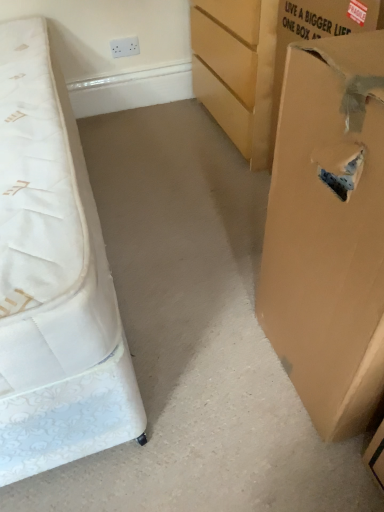
The image size is (384, 512). What do you see at coordinates (53, 278) in the screenshot? I see `white quilted mattress at left` at bounding box center [53, 278].

Describe the element at coordinates (328, 232) in the screenshot. I see `brown cardboard box at right, acting as the 2th cardboard box starting from the top` at that location.

Where is `white quilted mattress at left`? This screenshot has height=512, width=384. white quilted mattress at left is located at coordinates (53, 278).

What's the angular difference between brown cardboard box at right, acting as the 2th cardboard box starting from the top, and brown cardboard box at right, positioned as the 1th cardboard box in top-to-bottom order,'s facing directions?

The angular difference between brown cardboard box at right, acting as the 2th cardboard box starting from the top, and brown cardboard box at right, positioned as the 1th cardboard box in top-to-bottom order, is 1.47 degrees.

Is brown cardboard box at right, the 2th cardboard box in the back-to-front sequence, turned away from brown cardboard box at right, arranged as the second cardboard box when viewed from the front?

No, brown cardboard box at right, the 2th cardboard box in the back-to-front sequence,'s orientation is not away from brown cardboard box at right, arranged as the second cardboard box when viewed from the front.

Looking at this image, does brown cardboard box at right, marked as the first cardboard box in a bottom-to-top arrangement, lie in front of brown cardboard box at right, the 1th cardboard box positioned from the back?

Yes, it is.

Consider the image. Measure the distance between brown cardboard box at right, the 1th cardboard box from the front, and brown cardboard box at right, arranged as the second cardboard box when viewed from the front.

brown cardboard box at right, the 1th cardboard box from the front, and brown cardboard box at right, arranged as the second cardboard box when viewed from the front, are 29.28 inches apart.

Considering the sizes of white quilted mattress at left and brown cardboard box at right, the 2th cardboard box in the back-to-front sequence, in the image, is white quilted mattress at left bigger or smaller than brown cardboard box at right, the 2th cardboard box in the back-to-front sequence,?

white quilted mattress at left is bigger than brown cardboard box at right, the 2th cardboard box in the back-to-front sequence.

Would you say white quilted mattress at left is to the left or to the right of brown cardboard box at right, the 1th cardboard box from the front, in the picture?

white quilted mattress at left is positioned on brown cardboard box at right, the 1th cardboard box from the front,'s left side.

How many degrees apart are the facing directions of white quilted mattress at left and brown cardboard box at right, the 2th cardboard box in the back-to-front sequence?

The angle between the facing direction of white quilted mattress at left and the facing direction of brown cardboard box at right, the 2th cardboard box in the back-to-front sequence, is 89.6 degrees.

Measure the distance between white quilted mattress at left and brown cardboard box at right, marked as the first cardboard box in a bottom-to-top arrangement.

A distance of 19.97 inches exists between white quilted mattress at left and brown cardboard box at right, marked as the first cardboard box in a bottom-to-top arrangement.

Locate an element on the screen. cardboard box behind the white quilted mattress at left is located at coordinates (260, 58).

What's the angular difference between white quilted mattress at left and brown cardboard box at right, positioned as the 1th cardboard box in top-to-bottom order,'s facing directions?

They differ by 91.1 degrees in their facing directions.

Is white quilted mattress at left in front of or behind brown cardboard box at right, arranged as the second cardboard box when viewed from the front, in the image?

white quilted mattress at left is in front of brown cardboard box at right, arranged as the second cardboard box when viewed from the front.

Does brown cardboard box at right, marked as the first cardboard box in a bottom-to-top arrangement, appear on the right side of white quilted mattress at left?

Yes, brown cardboard box at right, marked as the first cardboard box in a bottom-to-top arrangement, is to the right of white quilted mattress at left.

From the image's perspective, is brown cardboard box at right, marked as the first cardboard box in a bottom-to-top arrangement, positioned above or below white quilted mattress at left?

brown cardboard box at right, marked as the first cardboard box in a bottom-to-top arrangement, is situated lower than white quilted mattress at left in the image.

Based on their sizes in the image, would you say brown cardboard box at right, marked as the first cardboard box in a bottom-to-top arrangement, is bigger or smaller than white quilted mattress at left?

Clearly, brown cardboard box at right, marked as the first cardboard box in a bottom-to-top arrangement, is smaller in size than white quilted mattress at left.

Is brown cardboard box at right, the 1th cardboard box from the front, looking in the opposite direction of white quilted mattress at left?

That's not correct — brown cardboard box at right, the 1th cardboard box from the front, is not looking away from white quilted mattress at left.

Considering the positions of objects brown cardboard box at right, which ranks as the second cardboard box in bottom-to-top order, and brown cardboard box at right, the 1th cardboard box from the front, in the image provided, who is behind, brown cardboard box at right, which ranks as the second cardboard box in bottom-to-top order, or brown cardboard box at right, the 1th cardboard box from the front,?

Positioned behind is brown cardboard box at right, which ranks as the second cardboard box in bottom-to-top order.

Is brown cardboard box at right, which ranks as the second cardboard box in bottom-to-top order, bigger than brown cardboard box at right, the 2th cardboard box in the back-to-front sequence?

Correct, brown cardboard box at right, which ranks as the second cardboard box in bottom-to-top order, is larger in size than brown cardboard box at right, the 2th cardboard box in the back-to-front sequence.

How distant is brown cardboard box at right, the 1th cardboard box positioned from the back, from brown cardboard box at right, the 2th cardboard box in the back-to-front sequence?

74.36 centimeters.

From the image's perspective, would you say brown cardboard box at right, arranged as the second cardboard box when viewed from the front, is shown under brown cardboard box at right, the 1th cardboard box from the front?

Actually, brown cardboard box at right, arranged as the second cardboard box when viewed from the front, appears above brown cardboard box at right, the 1th cardboard box from the front, in the image.

Is brown cardboard box at right, positioned as the 1th cardboard box in top-to-bottom order, to the left of white quilted mattress at left from the viewer's perspective?

No.

Does brown cardboard box at right, which ranks as the second cardboard box in bottom-to-top order, have a lesser height compared to white quilted mattress at left?

Incorrect, the height of brown cardboard box at right, which ranks as the second cardboard box in bottom-to-top order, does not fall short of that of white quilted mattress at left.

Considering the points (214, 61) and (18, 413), which point is in front, point (214, 61) or point (18, 413)?

The point (18, 413) is in front.

At what (x,y) coordinates should I click in order to perform the action: click on cardboard box that is in front of the brown cardboard box at right, positioned as the 1th cardboard box in top-to-bottom order. Please return your answer as a coordinate pair (x, y). The image size is (384, 512). Looking at the image, I should click on (328, 232).

Locate an element on the screen. bed that appears above the brown cardboard box at right, the 2th cardboard box in the back-to-front sequence (from the image's perspective) is located at coordinates (53, 278).

Looking at the image, which one is located further to white quilted mattress at left, brown cardboard box at right, the 1th cardboard box positioned from the back, or brown cardboard box at right, the 2th cardboard box in the back-to-front sequence?

brown cardboard box at right, the 1th cardboard box positioned from the back.

Considering their positions, is brown cardboard box at right, acting as the 2th cardboard box starting from the top, positioned further to brown cardboard box at right, which ranks as the second cardboard box in bottom-to-top order, than white quilted mattress at left?

Among the two, white quilted mattress at left is located further to brown cardboard box at right, which ranks as the second cardboard box in bottom-to-top order.

From the image, which object appears to be nearer to brown cardboard box at right, the 2th cardboard box in the back-to-front sequence, white quilted mattress at left or brown cardboard box at right, arranged as the second cardboard box when viewed from the front?

The object closer to brown cardboard box at right, the 2th cardboard box in the back-to-front sequence, is white quilted mattress at left.

In the scene shown: From the image, which object appears to be nearer to brown cardboard box at right, positioned as the 1th cardboard box in top-to-bottom order, white quilted mattress at left or brown cardboard box at right, the 1th cardboard box from the front?

Among the two, brown cardboard box at right, the 1th cardboard box from the front, is located nearer to brown cardboard box at right, positioned as the 1th cardboard box in top-to-bottom order.

When comparing their distances from white quilted mattress at left, does brown cardboard box at right, the 2th cardboard box in the back-to-front sequence, or brown cardboard box at right, which ranks as the second cardboard box in bottom-to-top order, seem further?

Based on the image, brown cardboard box at right, which ranks as the second cardboard box in bottom-to-top order, appears to be further to white quilted mattress at left.

Considering their positions, is brown cardboard box at right, which ranks as the second cardboard box in bottom-to-top order, positioned further to brown cardboard box at right, the 1th cardboard box from the front, than white quilted mattress at left?

Based on the image, brown cardboard box at right, which ranks as the second cardboard box in bottom-to-top order, appears to be further to brown cardboard box at right, the 1th cardboard box from the front.

Identify the location of cardboard box between white quilted mattress at left and brown cardboard box at right, the 1th cardboard box from the front. The width and height of the screenshot is (384, 512). pos(260,58).